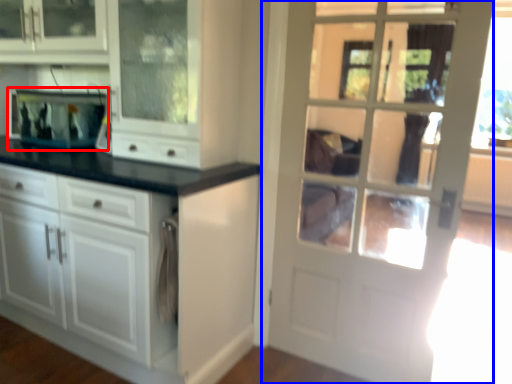
Question: Among these objects, which one is nearest to the camera, appliance (highlighted by a red box) or door (highlighted by a blue box)?

Choices:
 (A) appliance
 (B) door

Answer: (B)